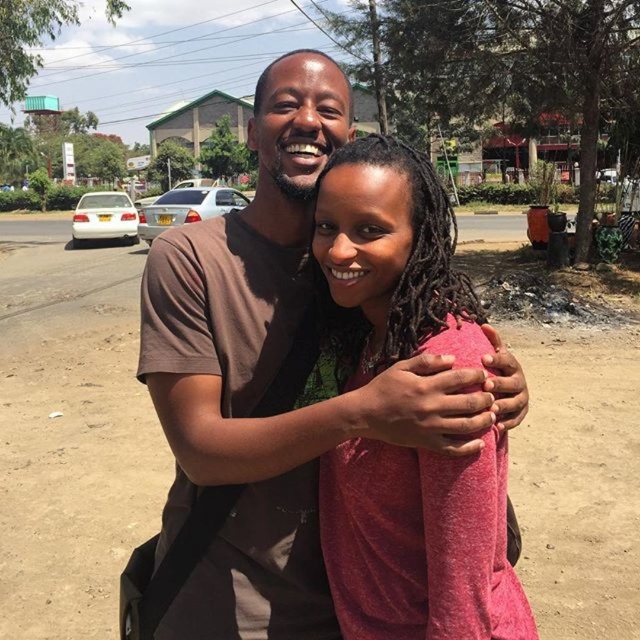
Question: Is brown cotton shirt at center smaller than matte pink shirt at center?

Choices:
 (A) yes
 (B) no

Answer: (B)

Question: Where is brown cotton shirt at center located in relation to matte pink shirt at center in the image?

Choices:
 (A) above
 (B) below

Answer: (A)

Question: Among these points, which one is farthest from the camera?

Choices:
 (A) (168, 556)
 (B) (342, 164)

Answer: (A)

Question: Which object is closer to the camera taking this photo?

Choices:
 (A) brown cotton shirt at center
 (B) matte pink shirt at center

Answer: (A)

Question: Which point is farther to the camera?

Choices:
 (A) brown cotton shirt at center
 (B) matte pink shirt at center

Answer: (B)

Question: Is brown cotton shirt at center to the left of matte pink shirt at center from the viewer's perspective?

Choices:
 (A) yes
 (B) no

Answer: (A)